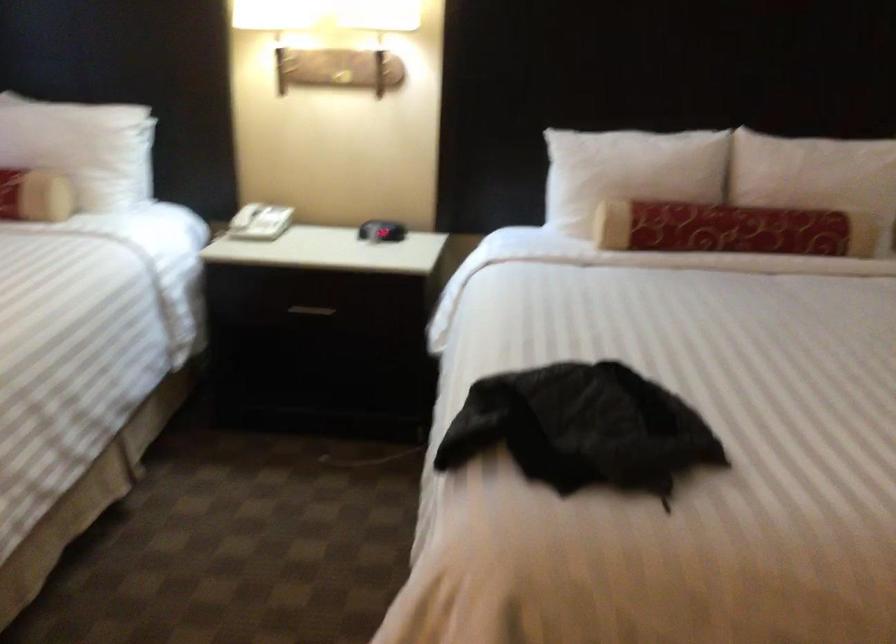
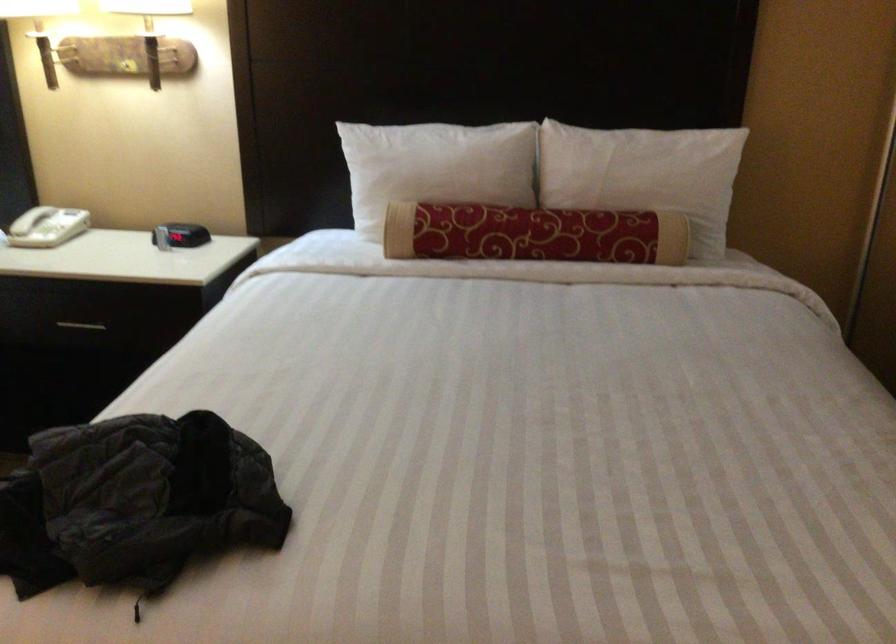
The point at (645, 165) is marked in the first image. Where is the corresponding point in the second image?

(435, 167)